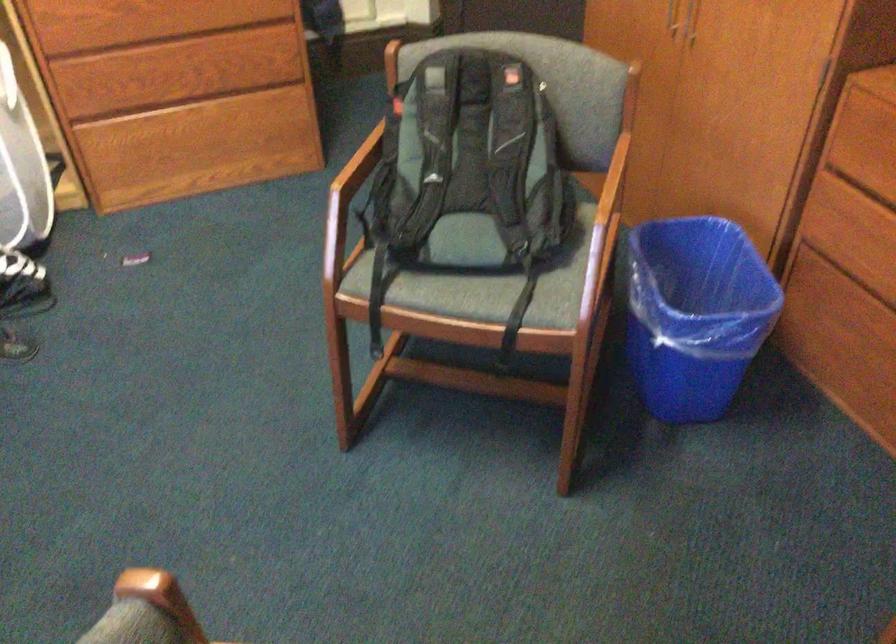
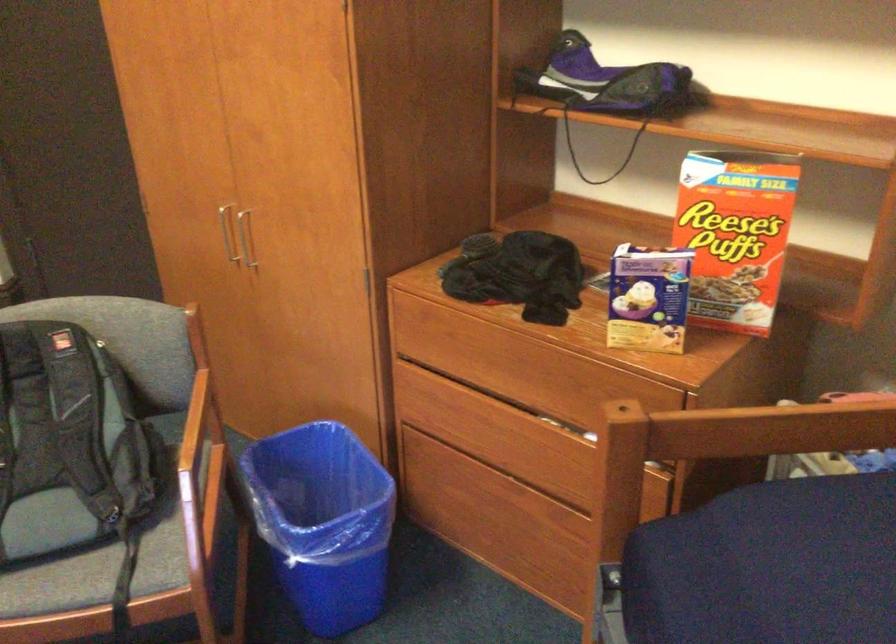
Question: How did the camera likely rotate?

Choices:
 (A) Left
 (B) Right
 (C) Up
 (D) Down

Answer: (B)